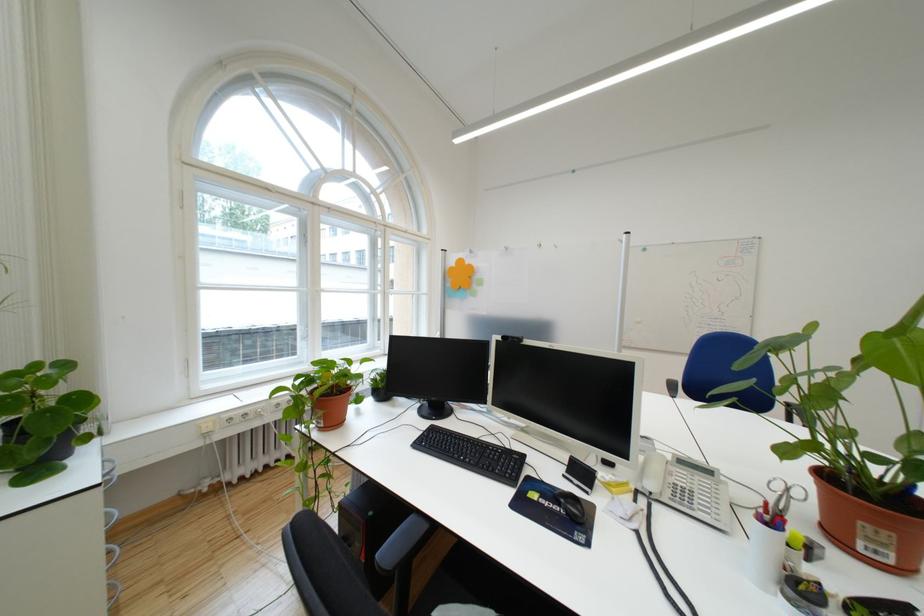
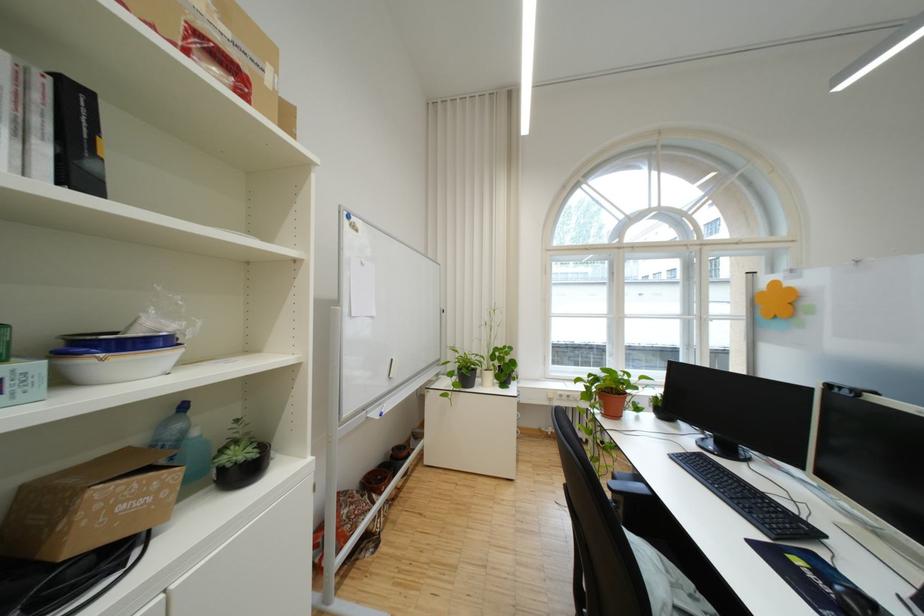
Question: The camera is either moving clockwise (left) or counter-clockwise (right) around the object. The first image is from the beginning of the video and the second image is from the end. Is the camera moving left or right when shooting the video?

Choices:
 (A) Left
 (B) Right

Answer: (B)